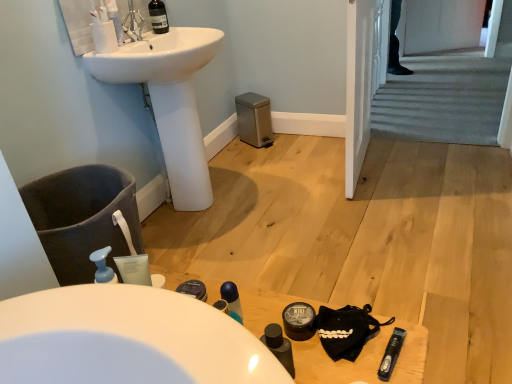
Where is `unoccupied region to the right of matte black container at lower center`? The image size is (512, 384). unoccupied region to the right of matte black container at lower center is located at coordinates (362, 333).